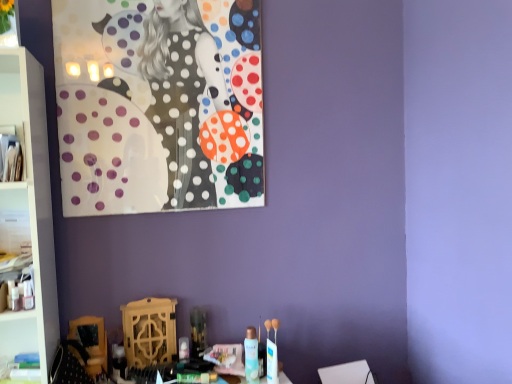
Question: Can you confirm if polished glass painting at upper left is bigger than translucent plastic spray can at center?

Choices:
 (A) yes
 (B) no

Answer: (A)

Question: Is polished glass painting at upper left behind translucent plastic spray can at center?

Choices:
 (A) no
 (B) yes

Answer: (B)

Question: Does polished glass painting at upper left appear on the left side of translucent plastic spray can at center?

Choices:
 (A) no
 (B) yes

Answer: (B)

Question: From the image's perspective, is polished glass painting at upper left below translucent plastic spray can at center?

Choices:
 (A) yes
 (B) no

Answer: (B)

Question: Is polished glass painting at upper left located outside translucent plastic spray can at center?

Choices:
 (A) no
 (B) yes

Answer: (B)

Question: Is polished glass painting at upper left to the left or to the right of translucent plastic spray can at center in the image?

Choices:
 (A) right
 (B) left

Answer: (B)

Question: Based on their sizes in the image, would you say polished glass painting at upper left is bigger or smaller than translucent plastic spray can at center?

Choices:
 (A) small
 (B) big

Answer: (B)

Question: From the image's perspective, is polished glass painting at upper left above or below translucent plastic spray can at center?

Choices:
 (A) below
 (B) above

Answer: (B)

Question: Is polished glass painting at upper left wider or thinner than translucent plastic spray can at center?

Choices:
 (A) thin
 (B) wide

Answer: (A)

Question: From a real-world perspective, is white glossy cabinet at left, which ranks as the 2th cabinet in front-to-back order, physically located above or below white plastic cabinet at left, which is the 2th cabinet from bottom to top?

Choices:
 (A) above
 (B) below

Answer: (B)

Question: Is white glossy cabinet at left, which is the second cabinet from top to bottom, bigger or smaller than white plastic cabinet at left, marked as the first cabinet in a top-to-bottom arrangement?

Choices:
 (A) big
 (B) small

Answer: (B)

Question: In terms of width, does white glossy cabinet at left, which ranks as the 2th cabinet in front-to-back order, look wider or thinner when compared to white plastic cabinet at left, which is the 2th cabinet from bottom to top?

Choices:
 (A) thin
 (B) wide

Answer: (A)

Question: Considering the positions of point (19, 231) and point (16, 168), is point (19, 231) closer or farther from the camera than point (16, 168)?

Choices:
 (A) closer
 (B) farther

Answer: (B)

Question: Looking at the image, does white glossy cabinet at left, which ranks as the 2th cabinet in front-to-back order, seem bigger or smaller compared to translucent plastic spray can at center?

Choices:
 (A) small
 (B) big

Answer: (B)

Question: From a real-world perspective, relative to translucent plastic spray can at center, is white glossy cabinet at left, which is the second cabinet from top to bottom, vertically above or below?

Choices:
 (A) above
 (B) below

Answer: (A)